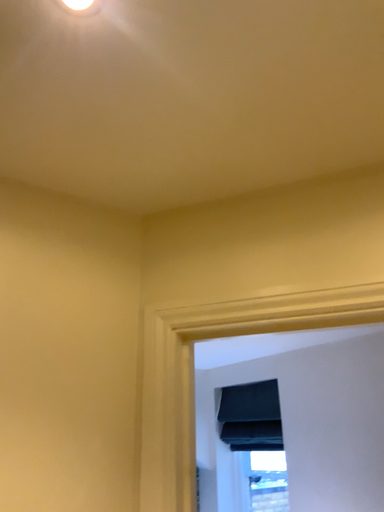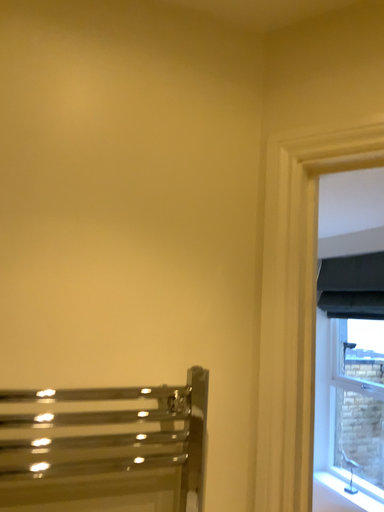
Question: How did the camera likely rotate when shooting the video?

Choices:
 (A) rotated upward
 (B) rotated downward

Answer: (B)